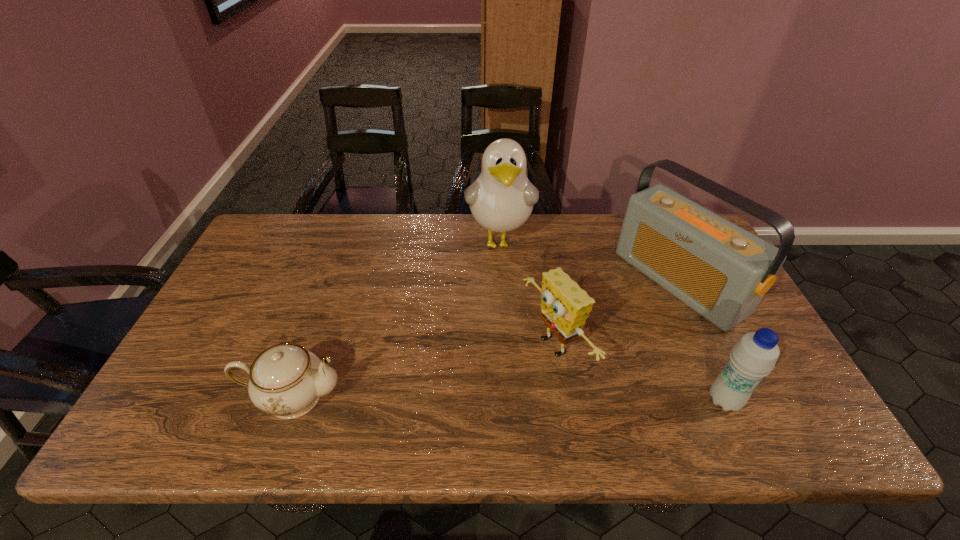
The image size is (960, 540). I want to click on empty space that is in between the radio receiver and the gull, so click(589, 261).

Where is `free point between the gull and the sponge`? free point between the gull and the sponge is located at coordinates (527, 294).

This screenshot has width=960, height=540. I want to click on vacant region between the gull and the sponge, so click(x=527, y=294).

This screenshot has height=540, width=960. Find the location of `empty location between the water bottle and the gull`. empty location between the water bottle and the gull is located at coordinates (612, 320).

Locate an element on the screen. free space between the gull and the water bottle is located at coordinates (612, 320).

This screenshot has width=960, height=540. Identify the location of vacant area that lies between the radio receiver and the sponge. point(616,314).

The width and height of the screenshot is (960, 540). Find the location of `empty space between the shortest object and the water bottle`. empty space between the shortest object and the water bottle is located at coordinates (509, 399).

Identify the location of free space that is in between the sponge and the shortest object. (424, 372).

Point out which object is positioned as the fourth nearest to the radio receiver. Please provide its 2D coordinates. Your answer should be formatted as a tuple, i.e. [(x, y)], where the tuple contains the x and y coordinates of a point satisfying the conditions above.

[(286, 380)]

Find the location of a particular element. The image size is (960, 540). object that is the closest one to the gull is located at coordinates (565, 306).